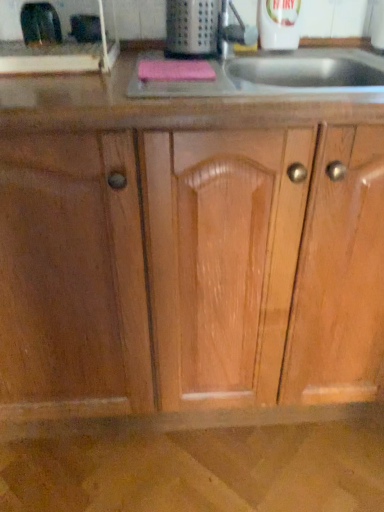
Question: Is black rubber gloves at upper left, the 3th appliance viewed from the right, taller or shorter than metallic grater at upper center, which appears as the third appliance when viewed from the left?

Choices:
 (A) tall
 (B) short

Answer: (B)

Question: Is black rubber gloves at upper left, the 3th appliance viewed from the right, wider or thinner than metallic grater at upper center, acting as the 1th appliance starting from the right?

Choices:
 (A) wide
 (B) thin

Answer: (B)

Question: Estimate the real-world distances between objects in this image. Which object is farther from the metallic silver toaster at upper left, which appears as the 2th appliance when viewed from the right?

Choices:
 (A) black rubber gloves at upper left, the 3th appliance viewed from the right
 (B) metallic grater at upper center, which appears as the third appliance when viewed from the left
 (C) pink fabric sponge at upper center

Answer: (C)

Question: Considering the real-world distances, which object is closest to the black rubber gloves at upper left, the 3th appliance viewed from the right?

Choices:
 (A) metallic grater at upper center, which appears as the third appliance when viewed from the left
 (B) pink fabric sponge at upper center
 (C) metallic silver toaster at upper left, which appears as the 2th appliance when viewed from the right

Answer: (C)